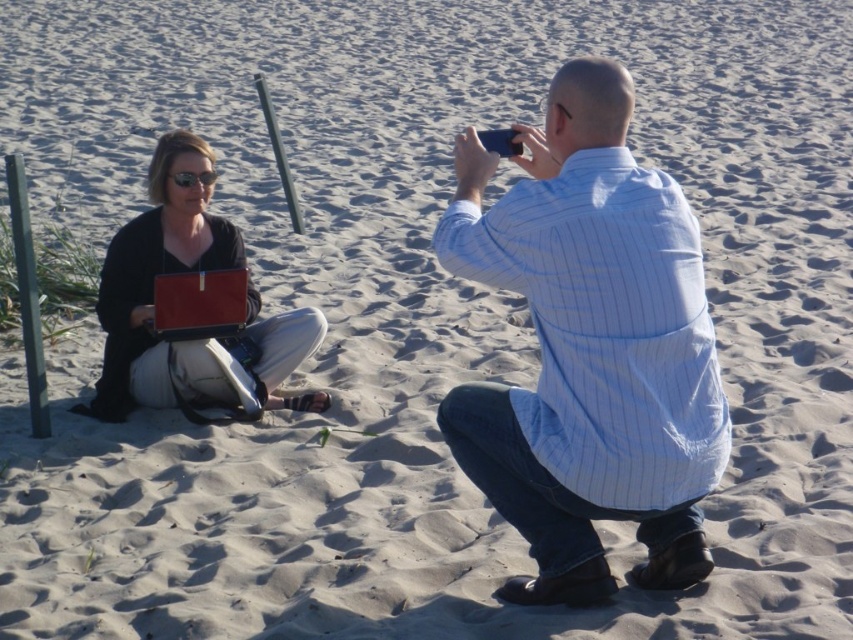
Is white striped shirt at center closer to camera compared to matte black laptop at left?

Yes, it is in front of matte black laptop at left.

Find the location of `white striped shirt at center`. white striped shirt at center is located at coordinates (589, 348).